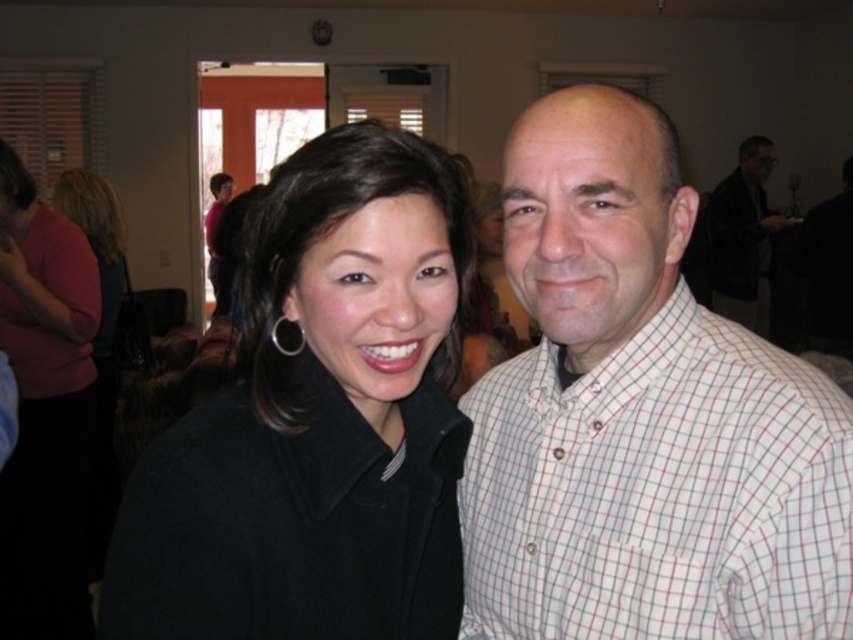
Question: Which is nearer to the matte black coat at center?

Choices:
 (A) dark gray suit at right
 (B) white checkered shirt at right
 (C) black wool coat at center

Answer: (C)

Question: Considering the real-world distances, which object is farthest from the matte black coat at center?

Choices:
 (A) black wool coat at center
 (B) white checkered shirt at right

Answer: (B)

Question: Estimate the real-world distances between objects in this image. Which object is farther from the dark gray suit at right?

Choices:
 (A) matte black coat at center
 (B) white checkered shirt at right
 (C) black wool coat at center

Answer: (C)

Question: Does white checkered shirt at right appear under dark gray suit at right?

Choices:
 (A) no
 (B) yes

Answer: (B)

Question: Does black wool coat at center have a smaller size compared to white checkered shirt at right?

Choices:
 (A) no
 (B) yes

Answer: (A)

Question: In this image, where is white checkered shirt at right located relative to matte black coat at center?

Choices:
 (A) left
 (B) right

Answer: (B)